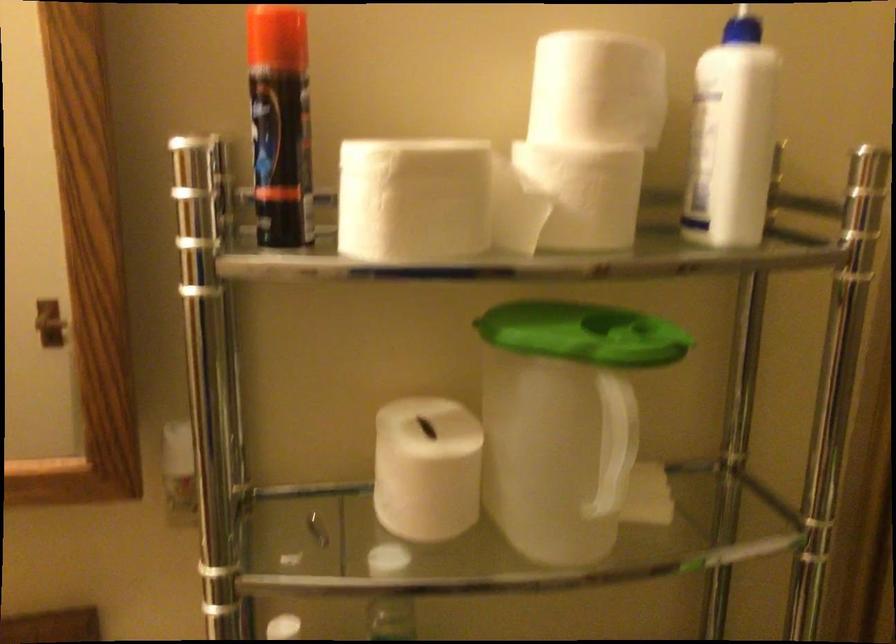
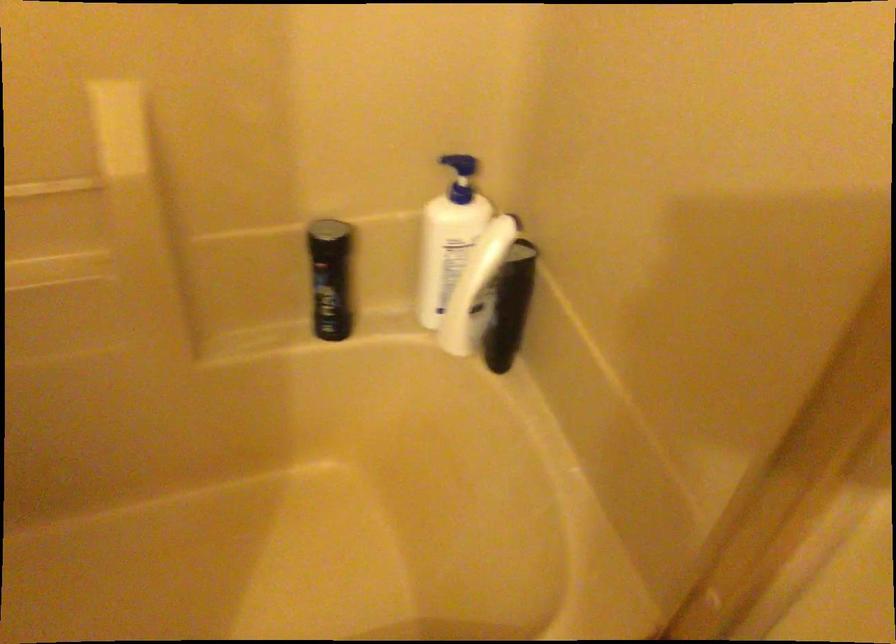
In the scene shown: Based on the continuous images, in which direction is the camera rotating?

The camera's rotation is toward right-down.